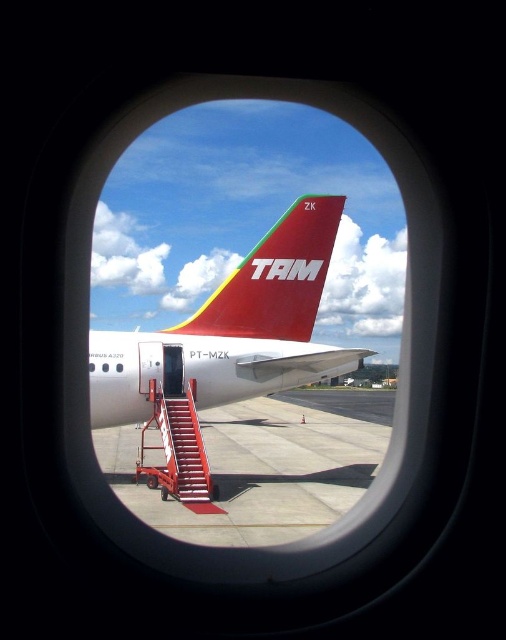
You are a pilot preparing to taxi your aircraft. You need to ensure there is enough space between the smooth concrete tarmac at center and the shiny red airplane tail at center to avoid collision. What is the minimum distance you should maintain between them?

The minimum distance you should maintain between the smooth concrete tarmac at center and the shiny red airplane tail at center is 6.05 meters, as they are already 6.05 meters apart, so maintaining that distance ensures no collision occurs.

You are a pilot preparing for takeoff and need to confirm the tail number of the aircraft you see through the circular window. According to the image, where exactly is the shiny red airplane tail at center located in terms of coordinates?

The shiny red airplane tail at center is located at coordinates (275,278).